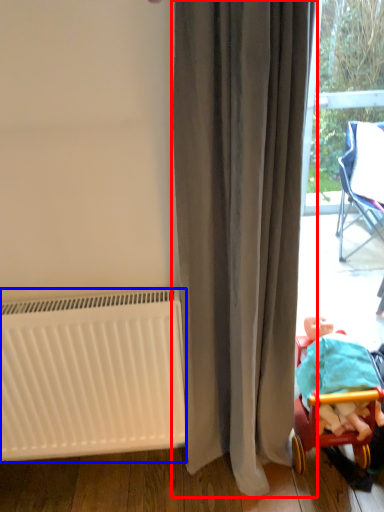
Question: Which object is closer to the camera taking this photo, curtain (highlighted by a red box) or radiator (highlighted by a blue box)?

Choices:
 (A) curtain
 (B) radiator

Answer: (A)